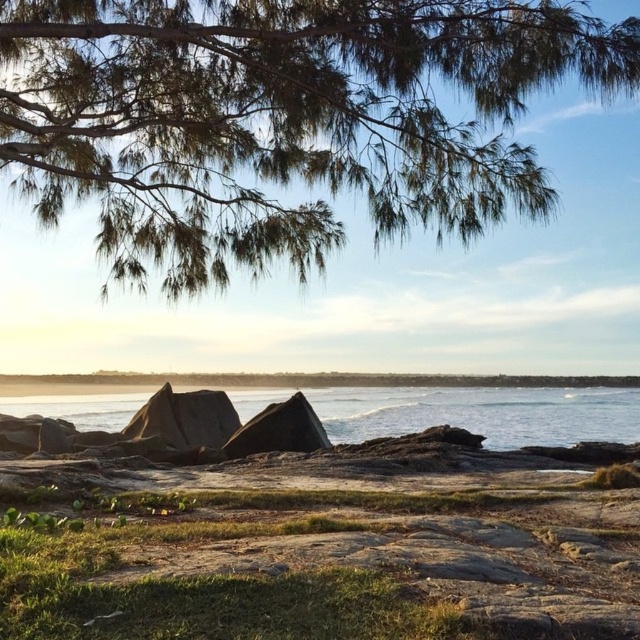
Question: Does green needle-like leaves at upper center have a greater width compared to clear blue water at center?

Choices:
 (A) no
 (B) yes

Answer: (A)

Question: Is green needle-like leaves at upper center to the left of clear blue water at center from the viewer's perspective?

Choices:
 (A) yes
 (B) no

Answer: (A)

Question: Among these objects, which one is nearest to the camera?

Choices:
 (A) green needle-like leaves at upper center
 (B) clear blue water at center

Answer: (A)

Question: Which of the following is the farthest from the observer?

Choices:
 (A) (188, 81)
 (B) (568, 394)

Answer: (B)

Question: Does green needle-like leaves at upper center come behind clear blue water at center?

Choices:
 (A) no
 (B) yes

Answer: (A)